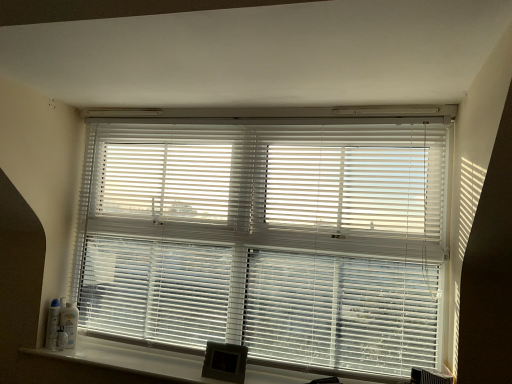
Question: Can you confirm if white plastic blinds at center is shorter than white smooth window sill at lower center?

Choices:
 (A) yes
 (B) no

Answer: (B)

Question: Could you tell me if white plastic blinds at center is facing white smooth window sill at lower center?

Choices:
 (A) yes
 (B) no

Answer: (B)

Question: Does white plastic blinds at center have a lesser width compared to white smooth window sill at lower center?

Choices:
 (A) no
 (B) yes

Answer: (B)

Question: Considering the relative sizes of white plastic blinds at center and white smooth window sill at lower center in the image provided, is white plastic blinds at center bigger than white smooth window sill at lower center?

Choices:
 (A) no
 (B) yes

Answer: (B)

Question: Is white plastic blinds at center to the left of white smooth window sill at lower center from the viewer's perspective?

Choices:
 (A) yes
 (B) no

Answer: (B)

Question: Is white plastic blinds at center directly adjacent to white smooth window sill at lower center?

Choices:
 (A) yes
 (B) no

Answer: (B)

Question: Is white smooth window sill at lower center positioned far away from white plastic blinds at center?

Choices:
 (A) no
 (B) yes

Answer: (A)

Question: Can you confirm if white smooth window sill at lower center is smaller than white plastic blinds at center?

Choices:
 (A) no
 (B) yes

Answer: (B)

Question: Is white smooth window sill at lower center at the left side of white plastic blinds at center?

Choices:
 (A) yes
 (B) no

Answer: (A)

Question: Does white smooth window sill at lower center have a lesser width compared to white plastic blinds at center?

Choices:
 (A) no
 (B) yes

Answer: (A)

Question: From the image's perspective, is white smooth window sill at lower center on white plastic blinds at center?

Choices:
 (A) yes
 (B) no

Answer: (B)

Question: Is the position of white smooth window sill at lower center less distant than that of white plastic blinds at center?

Choices:
 (A) no
 (B) yes

Answer: (B)

Question: From the image's perspective, is white smooth window sill at lower center above or below white plastic blinds at center?

Choices:
 (A) above
 (B) below

Answer: (B)